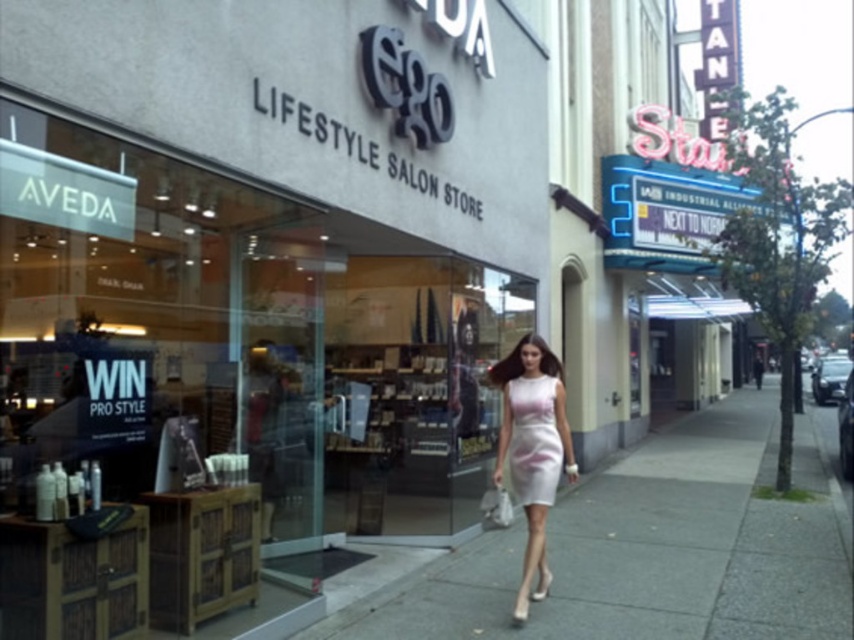
Question: Estimate the real-world distances between objects in this image. Which object is closer to the white smooth pavement at center?

Choices:
 (A) white satin dress at center
 (B) matte black sign at upper center

Answer: (A)

Question: Can you confirm if matte black sign at upper center is positioned above white satin dress at center?

Choices:
 (A) yes
 (B) no

Answer: (A)

Question: Is white satin dress at center thinner than pale pink satin dress at center?

Choices:
 (A) yes
 (B) no

Answer: (B)

Question: Which point is farther from the camera taking this photo?

Choices:
 (A) (515, 384)
 (B) (452, 572)
 (C) (539, 369)
 (D) (261, 435)

Answer: (B)

Question: Which point is closer to the camera taking this photo?

Choices:
 (A) (524, 397)
 (B) (548, 422)

Answer: (A)

Question: Observing the image, what is the correct spatial positioning of matte black sign at upper center in reference to white smooth pavement at center?

Choices:
 (A) below
 (B) above

Answer: (B)